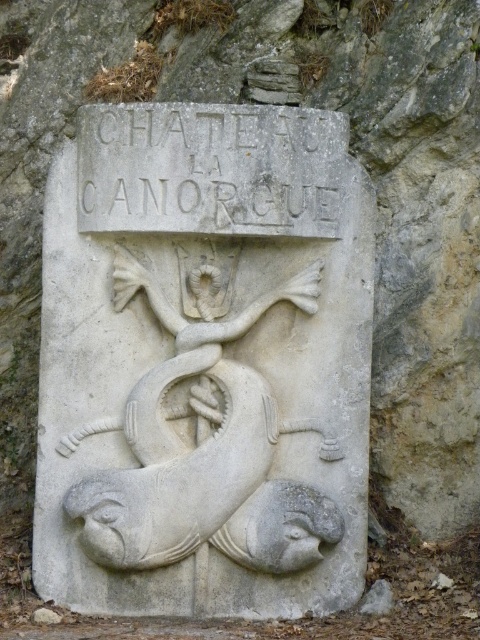
Which of these two, white stone fish at center or white stone text at center, stands shorter?

white stone text at center

Locate an element on the screen. This screenshot has width=480, height=640. white stone fish at center is located at coordinates (203, 445).

Identify the location of white stone fish at center. The image size is (480, 640). (203, 445).